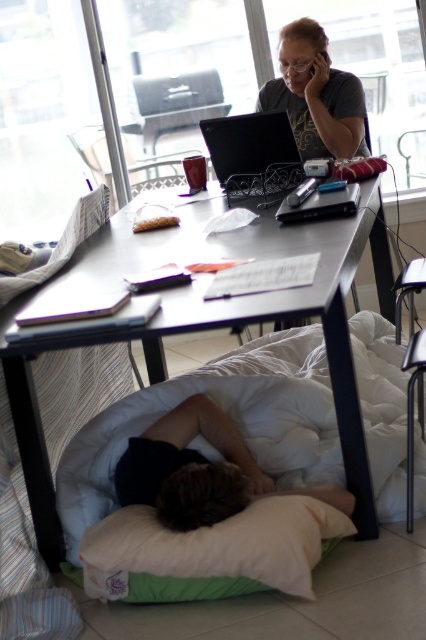
You are standing at the point with coordinates point (230, 518). What object are you standing on?

The point (230, 518) is on the white soft bed at lower center.

You are organizing a small event and need to place a 1.2 meter long banner on the matte black desk at center. Considering the size of the black plastic phone at upper center, will the banner fit on the desk?

The matte black desk at center is larger in size than the black plastic phone at upper center, so the banner may fit depending on the desk dimensions. However, the description only states the desk is larger than the phone, not the exact desk size. Without knowing the desk dimensions, it is uncertain if the banner will fit.